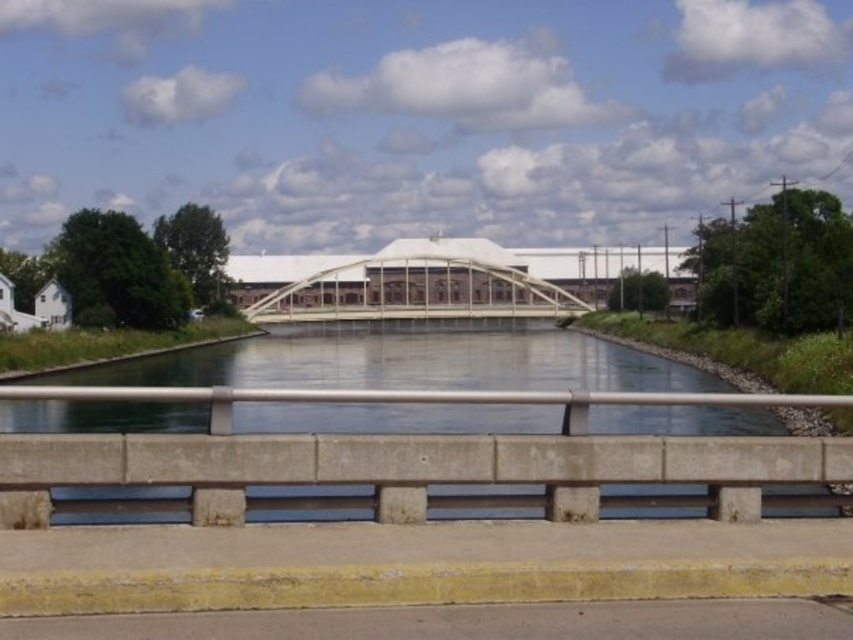
The height and width of the screenshot is (640, 853). Identify the location of clear concrete water at center. (415, 356).

Describe the element at coordinates (415, 356) in the screenshot. The height and width of the screenshot is (640, 853). I see `clear concrete water at center` at that location.

This screenshot has height=640, width=853. In order to click on clear concrete water at center in this screenshot , I will do `click(415, 356)`.